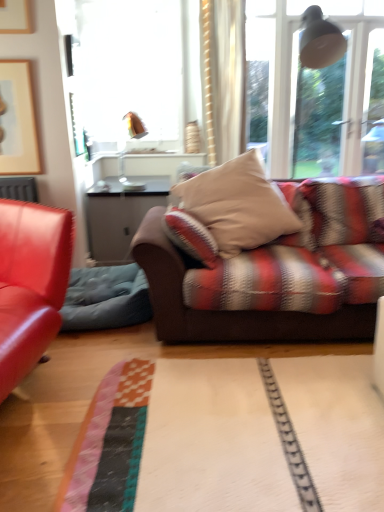
Question: From a real-world perspective, is beige fabric pillow at center under matte wooden picture frame at upper left?

Choices:
 (A) yes
 (B) no

Answer: (A)

Question: Considering the relative sizes of beige fabric pillow at center and matte wooden picture frame at upper left in the image provided, is beige fabric pillow at center shorter than matte wooden picture frame at upper left?

Choices:
 (A) no
 (B) yes

Answer: (B)

Question: Would you say beige fabric pillow at center contains matte wooden picture frame at upper left?

Choices:
 (A) yes
 (B) no

Answer: (B)

Question: From the image's perspective, would you say beige fabric pillow at center is positioned over matte wooden picture frame at upper left?

Choices:
 (A) yes
 (B) no

Answer: (B)

Question: Can you confirm if beige fabric pillow at center is taller than matte wooden picture frame at upper left?

Choices:
 (A) yes
 (B) no

Answer: (B)

Question: Can you confirm if beige fabric pillow at center is thinner than matte wooden picture frame at upper left?

Choices:
 (A) yes
 (B) no

Answer: (B)

Question: Can you confirm if beige fabric pillow at center is taller than copper metallic lamp at upper center?

Choices:
 (A) yes
 (B) no

Answer: (A)

Question: Is the depth of beige fabric pillow at center less than that of copper metallic lamp at upper center?

Choices:
 (A) yes
 (B) no

Answer: (A)

Question: Is beige fabric pillow at center not near copper metallic lamp at upper center?

Choices:
 (A) no
 (B) yes

Answer: (B)

Question: Is beige fabric pillow at center shorter than copper metallic lamp at upper center?

Choices:
 (A) yes
 (B) no

Answer: (B)

Question: Does beige fabric pillow at center appear on the right side of copper metallic lamp at upper center?

Choices:
 (A) no
 (B) yes

Answer: (B)

Question: From the image's perspective, is beige fabric pillow at center above copper metallic lamp at upper center?

Choices:
 (A) yes
 (B) no

Answer: (B)

Question: From a real-world perspective, is beige fabric pillow at center positioned under velvet blue swivel chair at left based on gravity?

Choices:
 (A) yes
 (B) no

Answer: (B)